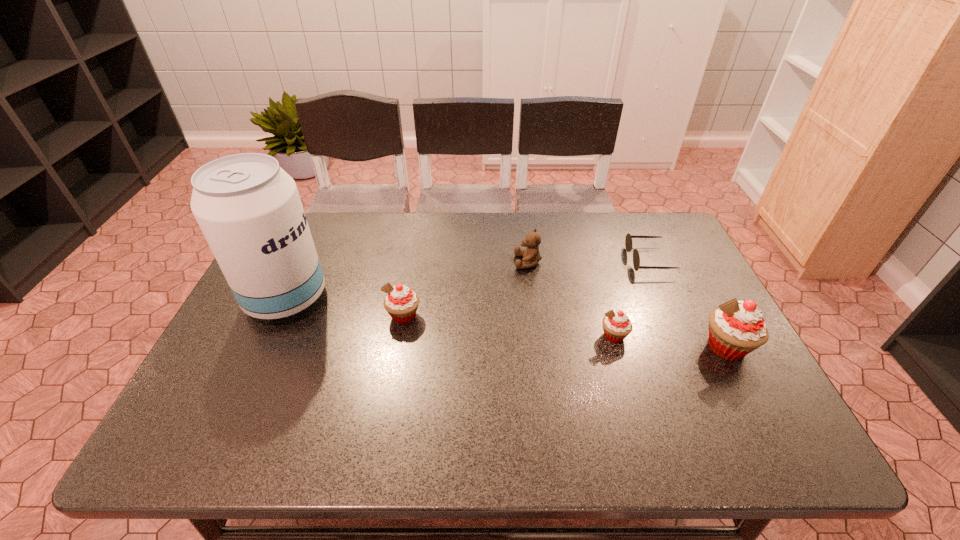
Identify the location of free space located on the front of the leftmost cupcake. Image resolution: width=960 pixels, height=540 pixels. (398, 344).

Locate an element on the screen. This screenshot has height=540, width=960. vacant space located 0.170m on the left of the third object from right to left is located at coordinates 533,336.

What are the coordinates of `vacant space located on the back of the fifth shortest object` in the screenshot? It's located at (702, 300).

Image resolution: width=960 pixels, height=540 pixels. I want to click on vacant space located on the front-facing side of the shortest object, so click(502, 260).

This screenshot has width=960, height=540. Find the location of `free location located on the front-facing side of the shortest object`. free location located on the front-facing side of the shortest object is located at coordinates [x=525, y=260].

At what (x,y) coordinates should I click in order to perform the action: click on vacant region located 0.230m on the front-facing side of the shortest object. Please return your answer as a coordinate pair (x, y). The height and width of the screenshot is (540, 960). Looking at the image, I should click on (554, 260).

I want to click on vacant space located 0.090m on the front-facing side of the fourth object from right to left, so click(485, 262).

The height and width of the screenshot is (540, 960). Find the location of `vacant space situated 0.050m on the front-facing side of the fourth object from right to left`. vacant space situated 0.050m on the front-facing side of the fourth object from right to left is located at coordinates (498, 262).

Find the location of a particular element. free location located on the front-facing side of the fourth object from right to left is located at coordinates (448, 262).

Find the location of a particular element. The image size is (960, 540). free point located 0.150m on the front of the leftmost object is located at coordinates (250, 376).